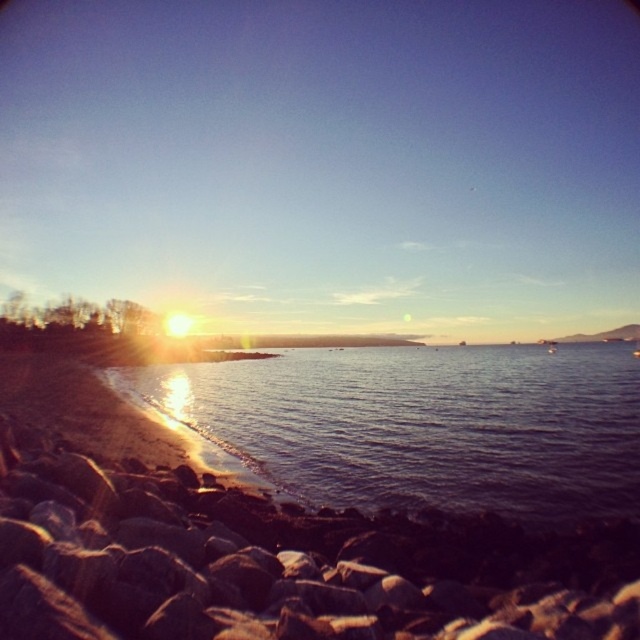
Question: Does smooth gray rock at lower left have a larger size compared to shiny blue water at lower left?

Choices:
 (A) yes
 (B) no

Answer: (B)

Question: Which object is farther from the camera taking this photo?

Choices:
 (A) smooth gray rock at lower left
 (B) shiny blue water at lower left

Answer: (B)

Question: Is smooth gray rock at lower left closer to the viewer compared to shiny blue water at lower left?

Choices:
 (A) no
 (B) yes

Answer: (B)

Question: Is smooth gray rock at lower left bigger than shiny blue water at lower left?

Choices:
 (A) yes
 (B) no

Answer: (B)